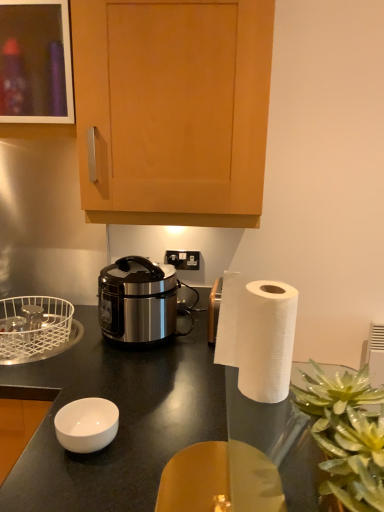
Question: From a real-world perspective, relative to white wire basket at left, is translucent glass vase at lower right vertically above or below?

Choices:
 (A) below
 (B) above

Answer: (B)

Question: Considering the positions of translucent glass vase at lower right and white wire basket at left in the image, is translucent glass vase at lower right wider or thinner than white wire basket at left?

Choices:
 (A) thin
 (B) wide

Answer: (A)

Question: Which is nearer to the black plastic power outlet at center?

Choices:
 (A) white wire basket at left
 (B) stainless steel rice cooker at center
 (C) translucent glass vase at lower right
 (D) black glossy desk at center
 (E) wooden cabinet at upper center, marked as the 2th cabinetry in a left-to-right arrangement

Answer: (B)

Question: Which object is positioned closest to the stainless steel rice cooker at center?

Choices:
 (A) white wire basket at left
 (B) black glossy desk at center
 (C) white glossy bowl at lower left
 (D) black plastic power outlet at center
 (E) wooden cabinet at upper center, marked as the 2th cabinetry in a left-to-right arrangement

Answer: (B)